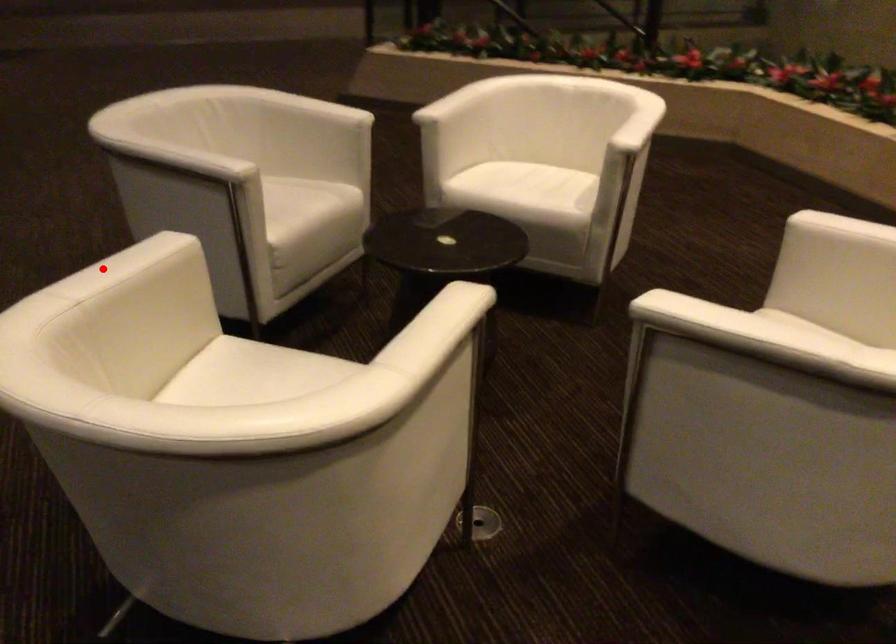
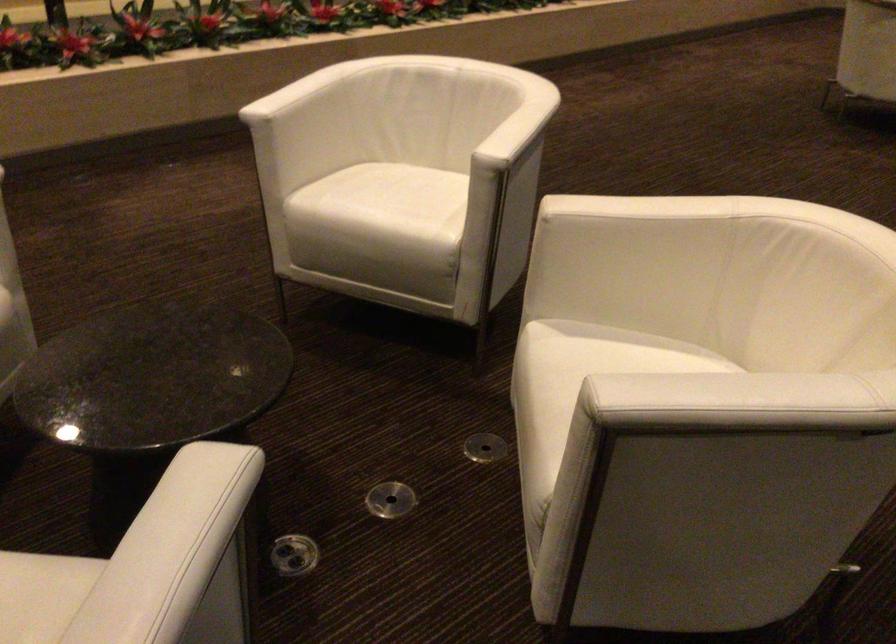
Find the pixel in the second image that matches the highlighted location in the first image.

(737, 402)